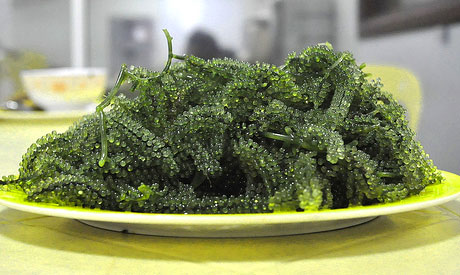
The height and width of the screenshot is (275, 460). I want to click on plate in the foreground, so click(x=229, y=218).